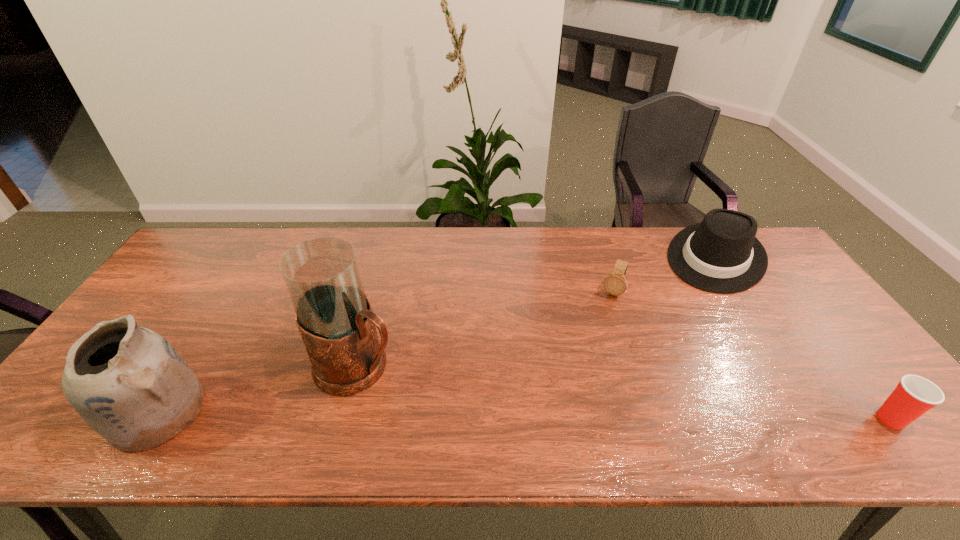
Locate an element on the screen. the leftmost object is located at coordinates (129, 384).

The width and height of the screenshot is (960, 540). What are the coordinates of `the second tallest object` in the screenshot? It's located at (129, 384).

Locate an element on the screen. The image size is (960, 540). Dixie cup is located at coordinates (914, 395).

Identify the location of watch. This screenshot has width=960, height=540. (615, 284).

Locate an element on the screen. The width and height of the screenshot is (960, 540). the second object from left to right is located at coordinates (334, 316).

Image resolution: width=960 pixels, height=540 pixels. What are the coordinates of `pitcher` in the screenshot? It's located at (334, 316).

Where is `fedora`? fedora is located at coordinates (722, 255).

Locate an element on the screen. The image size is (960, 540). vacant area situated 0.370m on the right of the leftmost object is located at coordinates (362, 413).

At what (x,y) coordinates should I click in order to perform the action: click on free space located 0.090m on the back of the Dixie cup. Please return your answer as a coordinate pair (x, y). Looking at the image, I should click on (855, 373).

Identify the location of free region located on the face of the third object from right to left. The height and width of the screenshot is (540, 960). (605, 314).